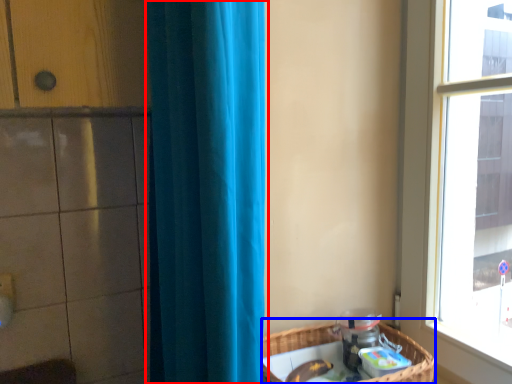
Question: Which of the following is the closest to the observer, curtain (highlighted by a red box) or basket (highlighted by a blue box)?

Choices:
 (A) curtain
 (B) basket

Answer: (A)